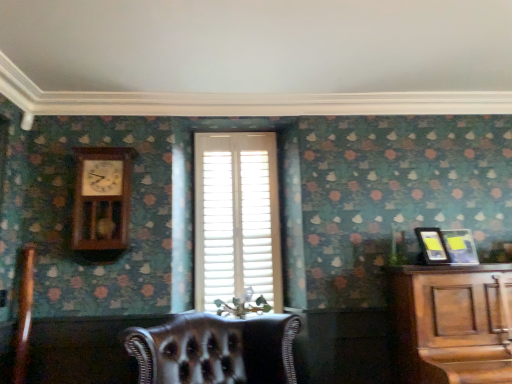
Question: In the image, is wooden pendulum clock at upper left positioned in front of or behind leather armchair at lower left?

Choices:
 (A) behind
 (B) front

Answer: (A)

Question: In terms of size, does wooden pendulum clock at upper left appear bigger or smaller than leather armchair at lower left?

Choices:
 (A) big
 (B) small

Answer: (A)

Question: Considering the real-world distances, which object is farthest from the leather armchair at lower left?

Choices:
 (A) metallic silver picture frame at right, which is the 1th picture frame from right to left
 (B) matte black picture frame at right, arranged as the 1th picture frame when viewed from the left
 (C) white wood blinds at center
 (D) wooden pendulum clock at upper left
 (E) leather at center

Answer: (A)

Question: Which object is the farthest from the metallic silver picture frame at right, which is the 1th picture frame from right to left?

Choices:
 (A) white wood blinds at center
 (B) matte black picture frame at right, which is counted as the second picture frame, starting from the right
 (C) leather armchair at lower left
 (D) wooden pendulum clock at upper left
 (E) leather at center

Answer: (C)